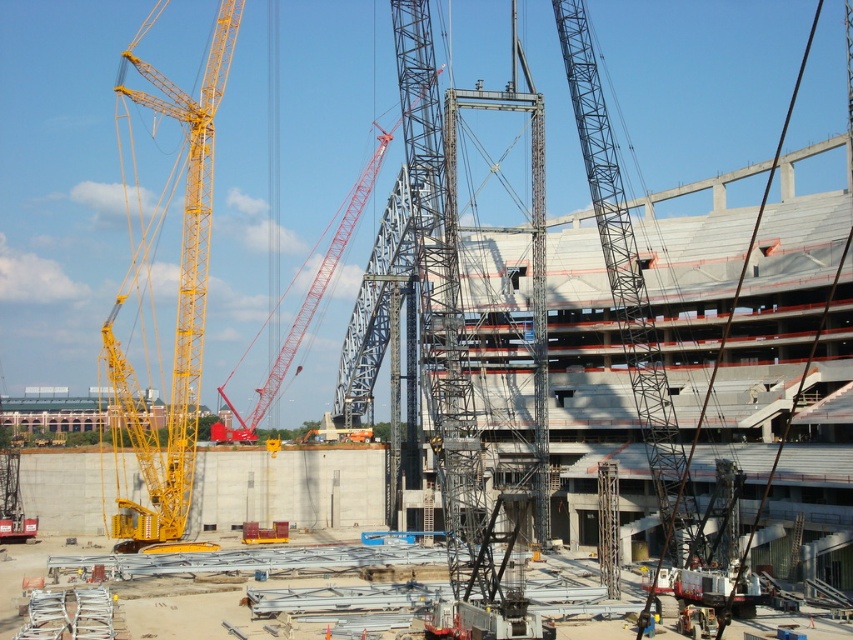
Does yellow metallic crane at left have a larger size compared to red metallic crane at center?

Correct, yellow metallic crane at left is larger in size than red metallic crane at center.

Describe the element at coordinates (177, 308) in the screenshot. I see `yellow metallic crane at left` at that location.

Is point (180, 476) positioned before point (297, 333)?

Yes.

Find the location of a particular element. yellow metallic crane at left is located at coordinates (177, 308).

Can you confirm if yellow metallic crane at left is positioned to the left of dark blue uniform at center?

Correct, you'll find yellow metallic crane at left to the left of dark blue uniform at center.

Identify the location of yellow metallic crane at left. (177, 308).

Who is more distant from viewer, [184,394] or [643,630]?

The point [184,394] is behind.

At what (x,y) coordinates should I click in order to perform the action: click on yellow metallic crane at left. Please return your answer as a coordinate pair (x, y). Image resolution: width=853 pixels, height=640 pixels. Looking at the image, I should click on (177, 308).

Is metallic gray crane at center to the left of dark blue uniform at center from the viewer's perspective?

No, metallic gray crane at center is not to the left of dark blue uniform at center.

Does point (601, 166) come in front of point (640, 634)?

No, it is behind (640, 634).

At what (x,y) coordinates should I click in order to perform the action: click on metallic gray crane at center. Please return your answer as a coordinate pair (x, y). The image size is (853, 640). Looking at the image, I should click on (625, 282).

In order to click on metallic gray crane at center in this screenshot , I will do `click(625, 282)`.